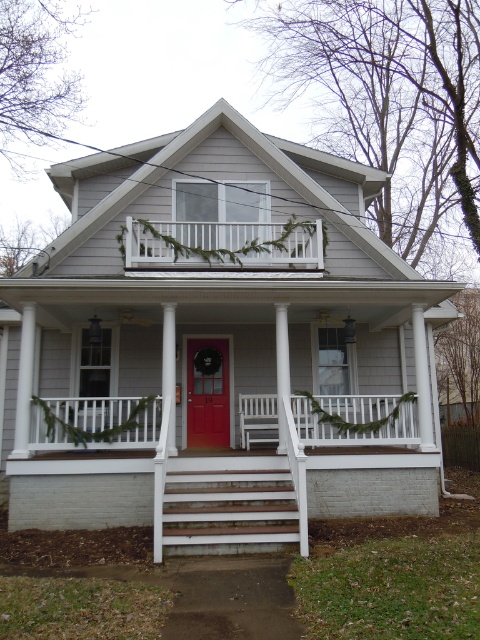
You are a painter who needs to decide whether to paint the white painted wood porch at upper center or the matte red door at center first. According to the spatial relationship between them, which one should you paint first?

The white painted wood porch at upper center is shorter than the matte red door at center, so you should paint the matte red door at center first to avoid dripping paint onto the lower porch.